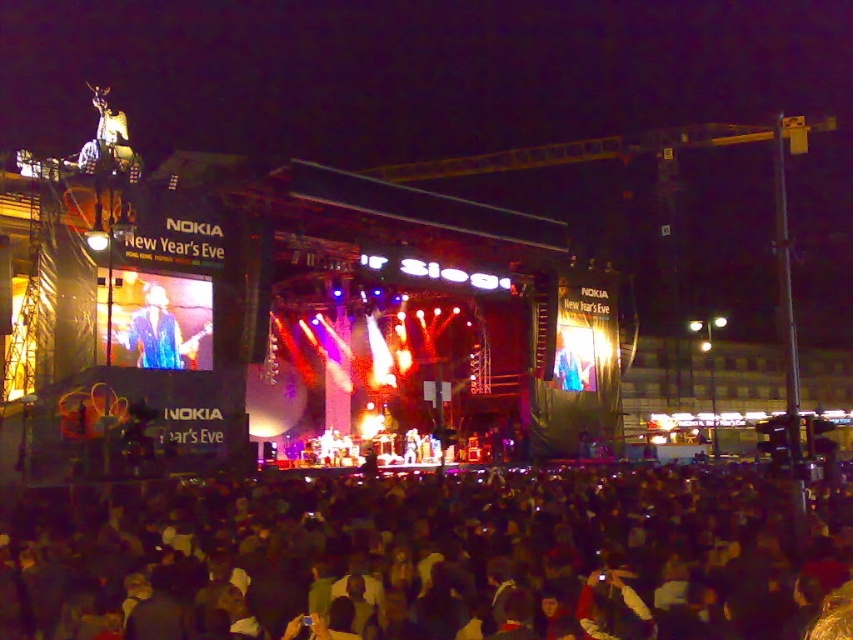
Question: Which object is closer to the camera taking this photo?

Choices:
 (A) dark fabric crowd at lower center
 (B) blue denim jacket at upper left

Answer: (A)

Question: Is dark fabric crowd at lower center wider than blue denim jacket at upper left?

Choices:
 (A) no
 (B) yes

Answer: (B)

Question: Does dark fabric crowd at lower center have a larger size compared to blue denim jacket at upper left?

Choices:
 (A) yes
 (B) no

Answer: (A)

Question: Does dark fabric crowd at lower center appear under blue denim jacket at upper left?

Choices:
 (A) no
 (B) yes

Answer: (B)